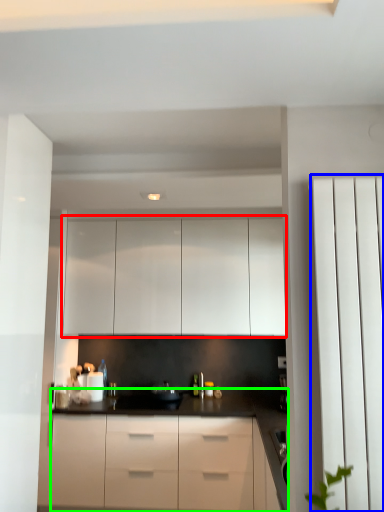
Question: Considering the real-world distances, which object is closest to cabinetry (highlighted by a red box)? screen door (highlighted by a blue box) or countertop (highlighted by a green box).

Choices:
 (A) screen door
 (B) countertop

Answer: (B)